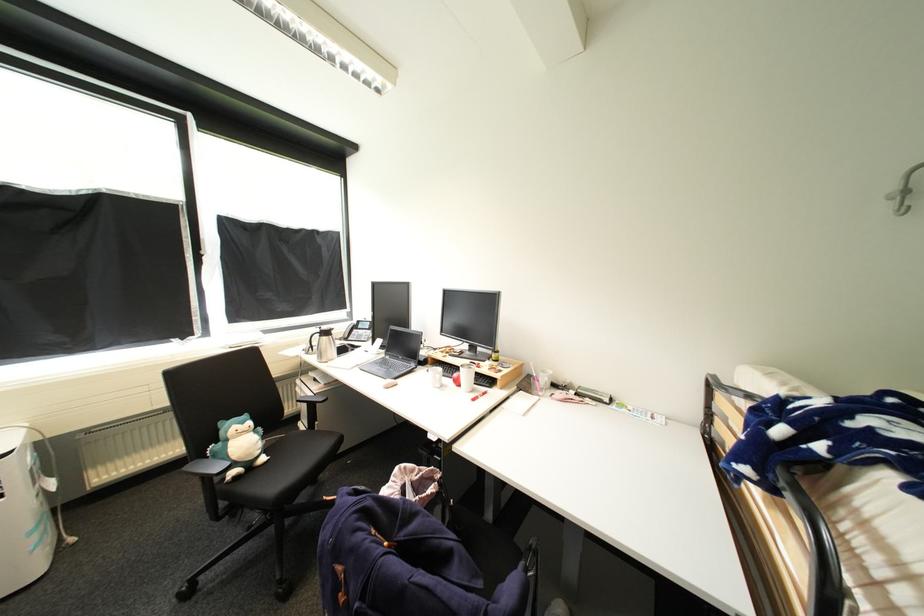
Locate an element on the screen. Image resolution: width=924 pixels, height=616 pixels. black chair armrest is located at coordinates (207, 468).